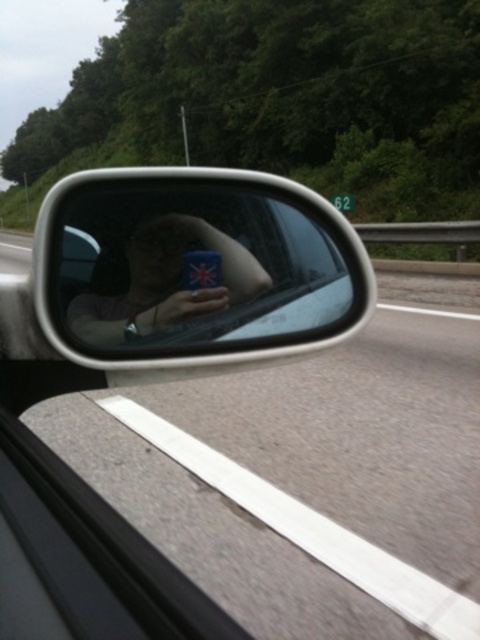
Consider the image. You are a driver checking your side mirror and notice a point at coordinates (x=69, y=330). If your mirror has a field of view that can only clearly display objects within 1 meter, can you see this point clearly?

The distance of point (x=69, y=330) from camera is 84.81 centimeters, which is within the 1 meter range. Therefore, the point can be seen clearly in the mirror.

You are a driver checking your side mirror and notice a point marked at coordinates (186,266). Based on the mirror reflection, where is this point located in relation to the silver metallic mirror at center?

The point marked at coordinates (186,266) directly marks the location of the silver metallic mirror at center in the reflection.